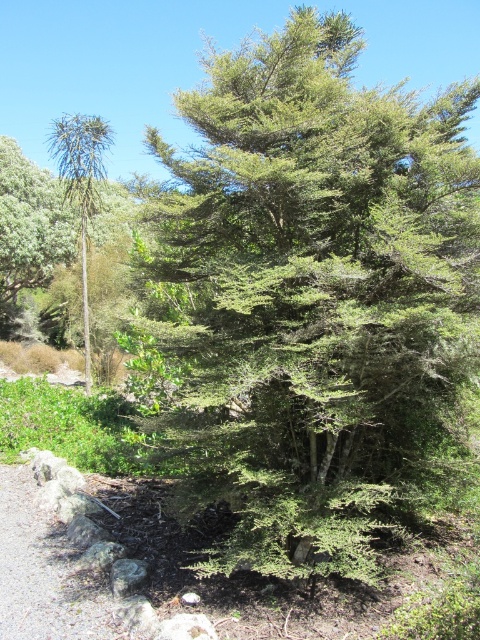
Can you confirm if green leafy tree at center is taller than gray gravel trail at lower left?

Indeed, green leafy tree at center has a greater height compared to gray gravel trail at lower left.

Can you confirm if green leafy tree at center is positioned above gray gravel trail at lower left?

Yes.

Locate an element on the screen. The width and height of the screenshot is (480, 640). green leafy tree at center is located at coordinates (313, 305).

Where is `green leafy tree at center`? green leafy tree at center is located at coordinates (313, 305).

Does green leafy tree at center appear over green leafy tree at left?

Incorrect, green leafy tree at center is not positioned above green leafy tree at left.

Looking at this image, who is positioned more to the right, green leafy tree at center or green leafy tree at left?

From the viewer's perspective, green leafy tree at center appears more on the right side.

Does point (179, 264) lie behind point (79, 141)?

No, it is in front of (79, 141).

Where is `green leafy tree at center`? This screenshot has height=640, width=480. green leafy tree at center is located at coordinates (313, 305).

Does gray gravel trail at lower left have a larger size compared to green leafy tree at left?

No, gray gravel trail at lower left is not bigger than green leafy tree at left.

Does gray gravel trail at lower left have a greater height compared to green leafy tree at left?

No, gray gravel trail at lower left is not taller than green leafy tree at left.

Find the location of a particular element. gray gravel trail at lower left is located at coordinates (41, 572).